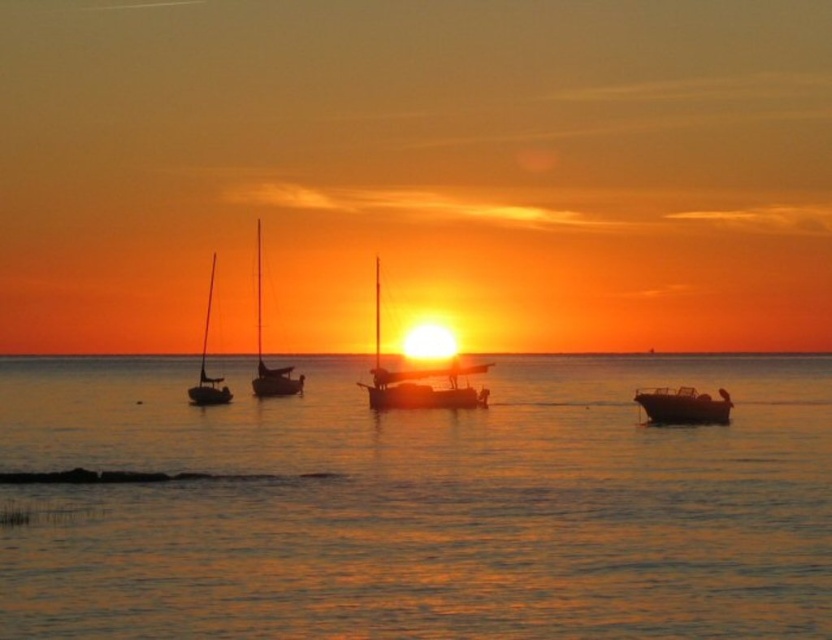
You are a photographer standing on the shore and want to capture the smooth water at center and the satin black sailboat at left in your shot. Which object should you adjust your camera to focus on first if you want to include both in the frame?

The satin black sailboat at left is to the left of the smooth water at center, so you should focus on the satin black sailboat at left first to ensure both are in the frame.